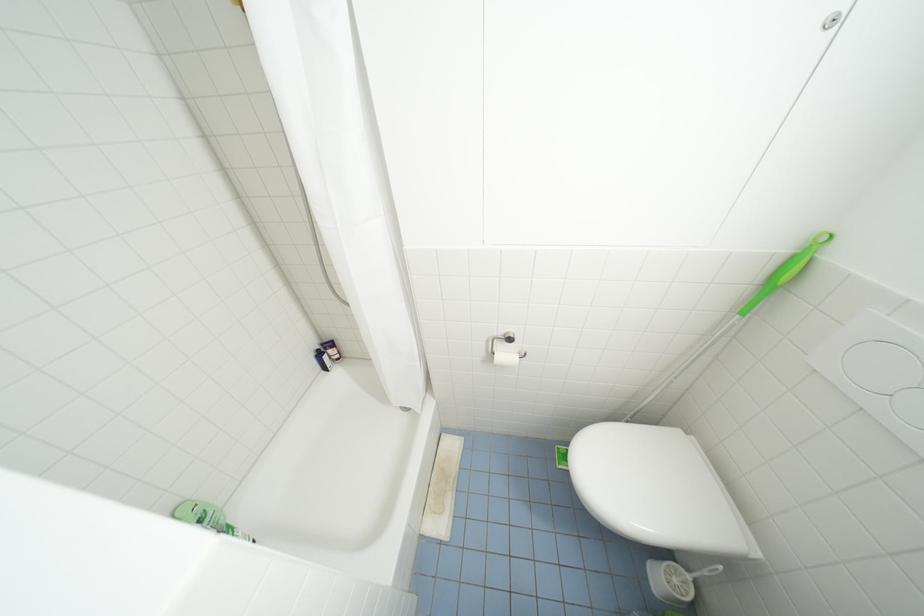
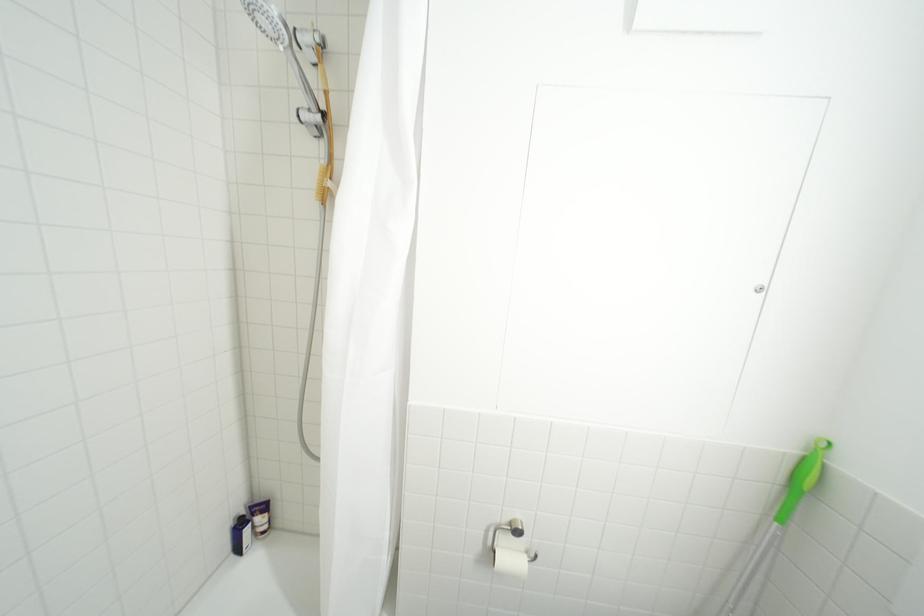
Question: The first image is from the beginning of the video and the second image is from the end. How did the camera likely rotate when shooting the video?

Choices:
 (A) Left
 (B) Right
 (C) Up
 (D) Down

Answer: (C)